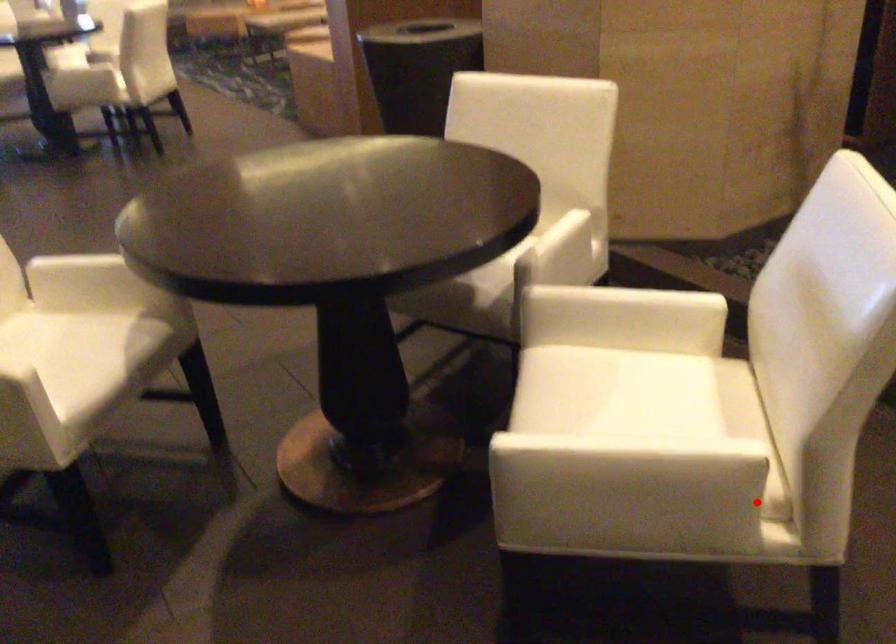
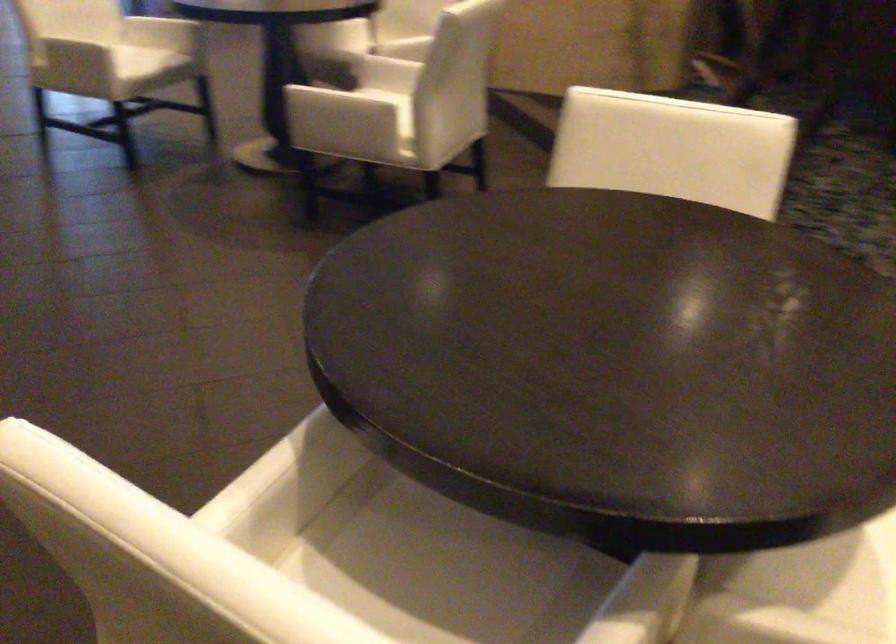
In the second image, find the point that corresponds to the highlighted location in the first image.

(371, 109)